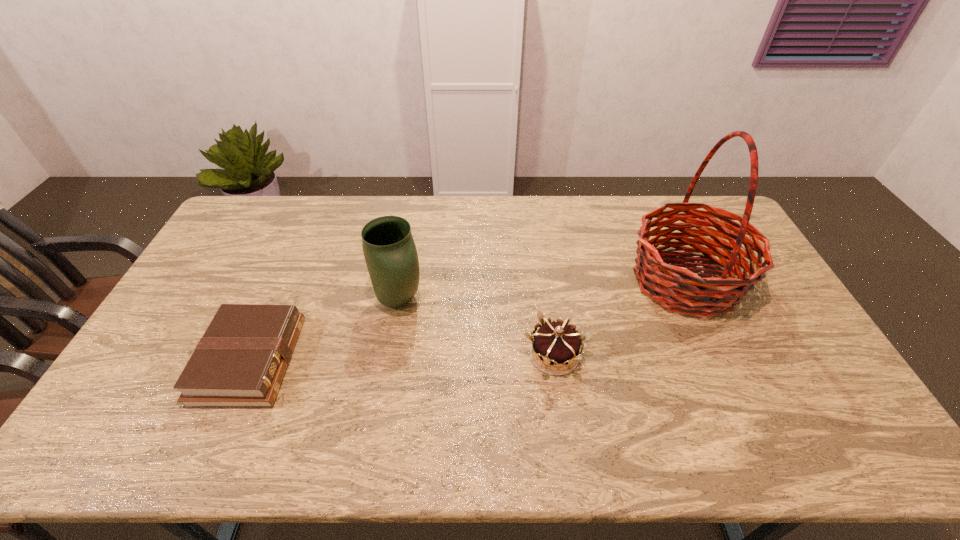
Locate an element on the screen. The image size is (960, 540). free space located 0.200m on the handle side of the rightmost object is located at coordinates tap(564, 281).

The width and height of the screenshot is (960, 540). I want to click on free space located 0.210m on the back of the third object from right to left, so click(410, 239).

The image size is (960, 540). What are the coordinates of `vacant area located on the back of the second shortest object` in the screenshot? It's located at (543, 281).

Where is `vacant space located on the spine side of the shortest object`? The height and width of the screenshot is (540, 960). vacant space located on the spine side of the shortest object is located at coordinates (314, 360).

At what (x,y) coordinates should I click in order to perform the action: click on object that is at the right edge. Please return your answer as a coordinate pair (x, y). This screenshot has width=960, height=540. Looking at the image, I should click on (696, 295).

In the image, there is a desktop. Where is `vacant area at the far edge`? vacant area at the far edge is located at coordinates (433, 198).

Locate an element on the screen. Image resolution: width=960 pixels, height=540 pixels. blank space at the near edge of the desktop is located at coordinates (212, 428).

In the image, there is a desktop. What are the coordinates of `vacant region at the left edge` in the screenshot? It's located at (228, 243).

Locate an element on the screen. The height and width of the screenshot is (540, 960). free space at the right edge is located at coordinates (800, 367).

This screenshot has width=960, height=540. I want to click on free space between the leftmost object and the basket, so click(x=468, y=321).